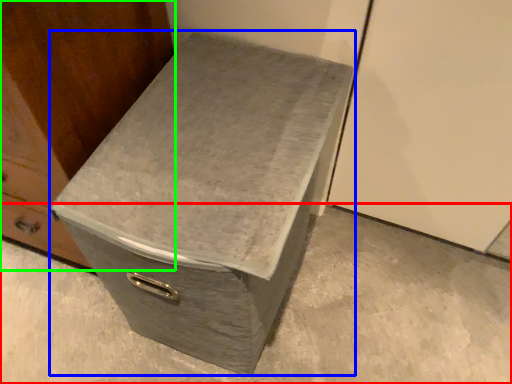
Question: Which object is positioned closest to concrete (highlighted by a red box)? Select from shoe box (highlighted by a blue box) and furniture (highlighted by a green box).

Choices:
 (A) shoe box
 (B) furniture

Answer: (A)